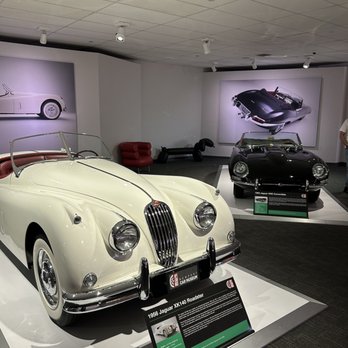
Find the location of a particular element. black tile floor is located at coordinates (320, 261), (199, 164), (335, 186), (279, 240), (318, 334).